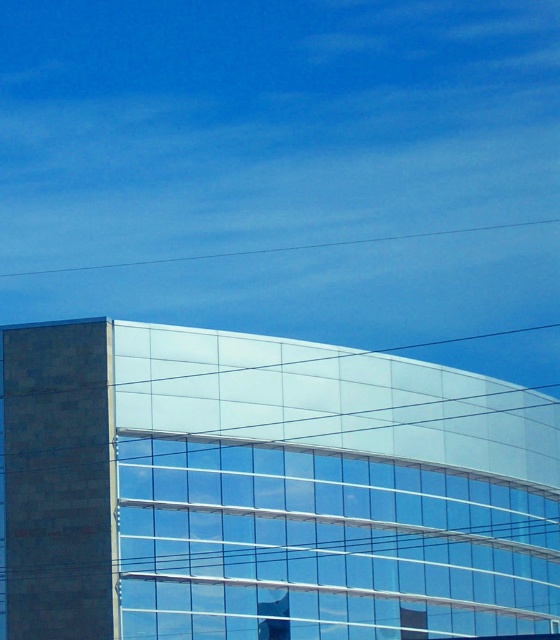
Question: Does transparent glass window at center appear over metallic glass window at center?

Choices:
 (A) no
 (B) yes

Answer: (B)

Question: Which of the following is the farthest from the observer?

Choices:
 (A) metallic glass window at center
 (B) transparent glass window at center

Answer: (A)

Question: In this image, where is transparent glass window at center located relative to metallic glass window at center?

Choices:
 (A) below
 (B) above

Answer: (B)

Question: Is transparent glass window at center bigger than metallic glass window at center?

Choices:
 (A) yes
 (B) no

Answer: (A)

Question: Among these points, which one is nearest to the camera?

Choices:
 (A) (404, 632)
 (B) (282, 634)

Answer: (B)